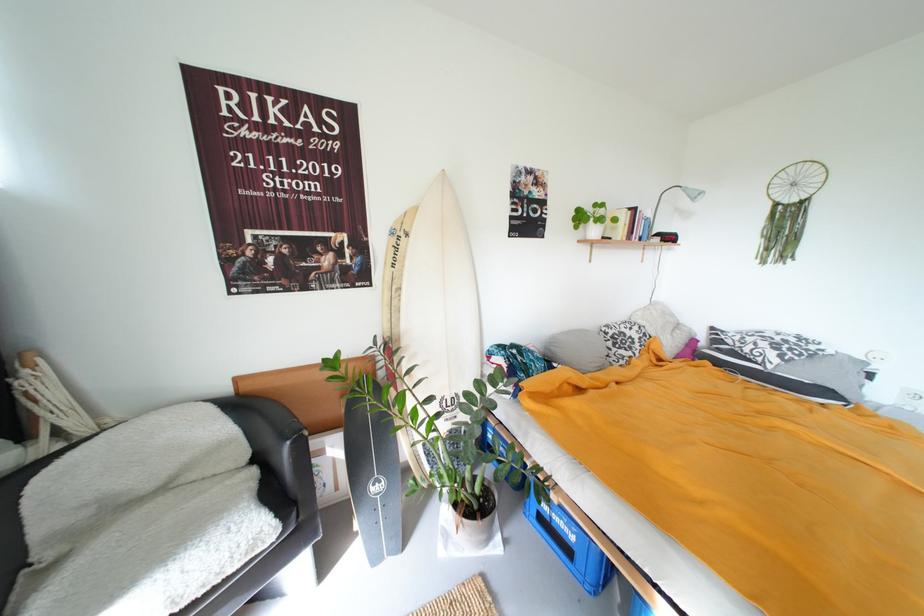
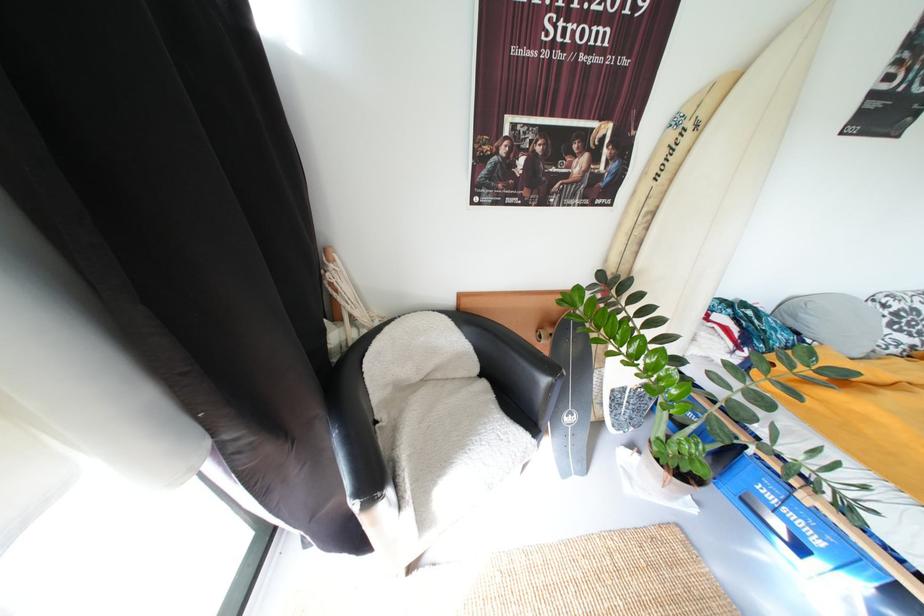
Question: Which direction would the cameraman need to move to produce the second image? Reply with the corresponding letter.

Choices:
 (A) Left
 (B) Right
 (C) Forward
 (D) Backward

Answer: (A)